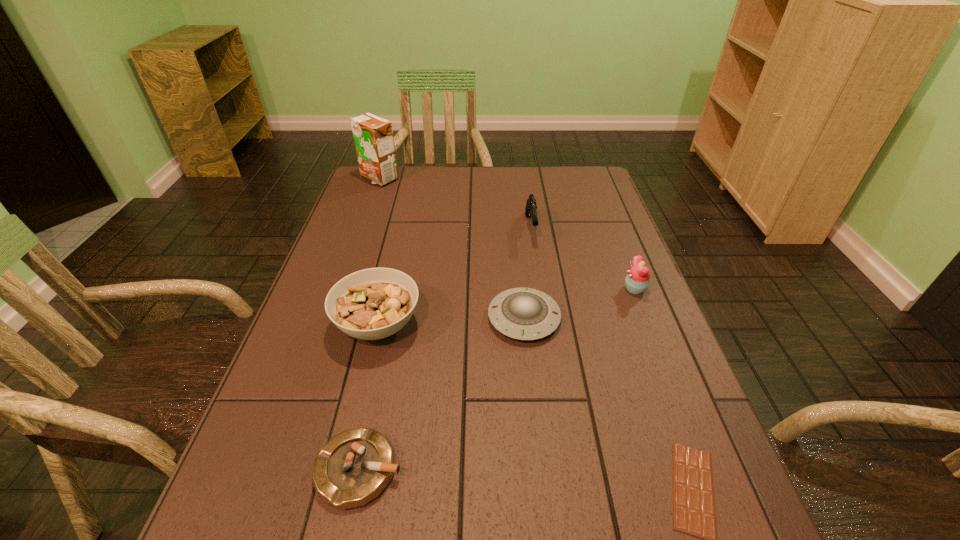
Identify the location of object located at the far left corner. The width and height of the screenshot is (960, 540). (373, 136).

Identify the location of vacant space at the far edge of the desktop. Image resolution: width=960 pixels, height=540 pixels. (541, 198).

The width and height of the screenshot is (960, 540). What are the coordinates of `vacant space at the left edge` in the screenshot? It's located at (345, 238).

I want to click on vacant space at the right edge, so click(623, 253).

Locate an element on the screen. This screenshot has width=960, height=540. vacant space that is in between the ashtray and the stew is located at coordinates (369, 397).

Where is `blank region between the farthest object and the saucer`? The image size is (960, 540). blank region between the farthest object and the saucer is located at coordinates (451, 248).

Locate an element on the screen. vacant space that is in between the carton and the gun is located at coordinates (455, 203).

In order to click on vacant area that lies between the tallest object and the third shortest object in this screenshot , I will do `click(451, 248)`.

At what (x,y) coordinates should I click in order to perform the action: click on free area in between the carton and the stew. Please return your answer as a coordinate pair (x, y). The image size is (960, 540). Looking at the image, I should click on (378, 252).

At what (x,y) coordinates should I click in order to perform the action: click on vacant space in between the stew and the second farthest object. Please return your answer as a coordinate pair (x, y). The image size is (960, 540). Looking at the image, I should click on coord(454,276).